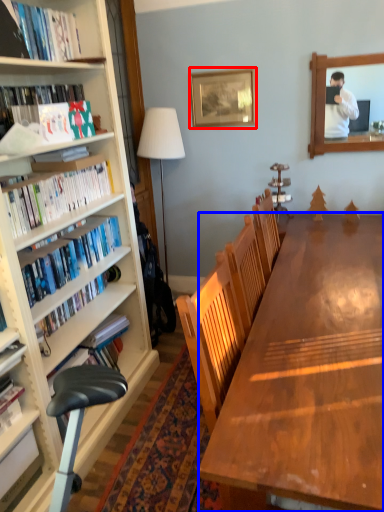
Question: Among these objects, which one is nearest to the camera, picture frame (highlighted by a red box) or desk (highlighted by a blue box)?

Choices:
 (A) picture frame
 (B) desk

Answer: (B)